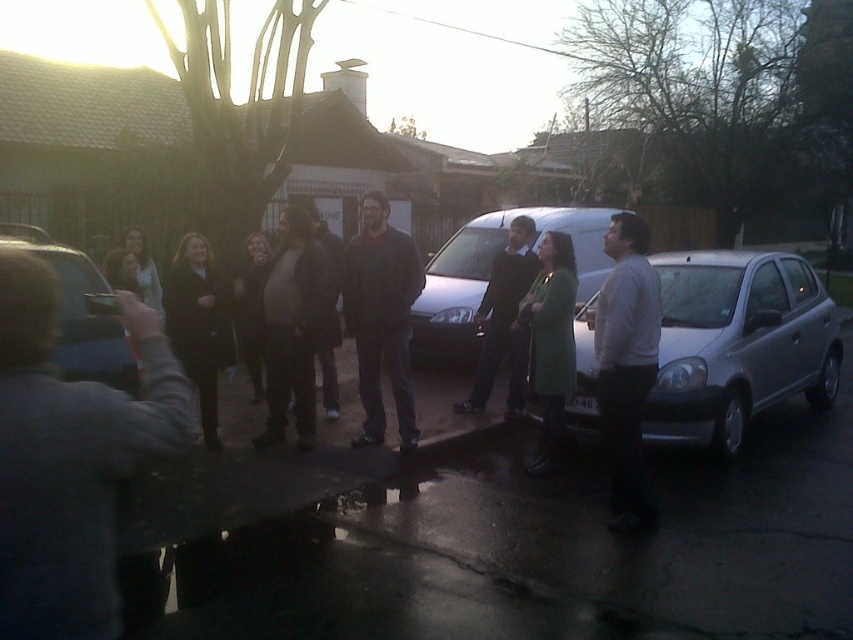
Question: Observing the image, what is the correct spatial positioning of matte black van at center in reference to dark green sweater at center?

Choices:
 (A) right
 (B) left

Answer: (A)

Question: Which object appears closest to the camera in this image?

Choices:
 (A) metallic silver car at center
 (B) dark gray jacket at center
 (C) green woolen coat at center

Answer: (A)

Question: Which object is the farthest from the dark green sweater at center?

Choices:
 (A) satin silver car at right
 (B) dark gray wool coat at center

Answer: (B)

Question: Which point is closer to the camera?

Choices:
 (A) (119, 595)
 (B) (741, 392)
 (C) (537, 291)
 (D) (494, 276)

Answer: (A)

Question: Does gray fabric at left have a larger size compared to dark gray jacket at center?

Choices:
 (A) no
 (B) yes

Answer: (A)

Question: Does matte black van at center lie behind dark gray sweater at center?

Choices:
 (A) yes
 (B) no

Answer: (A)